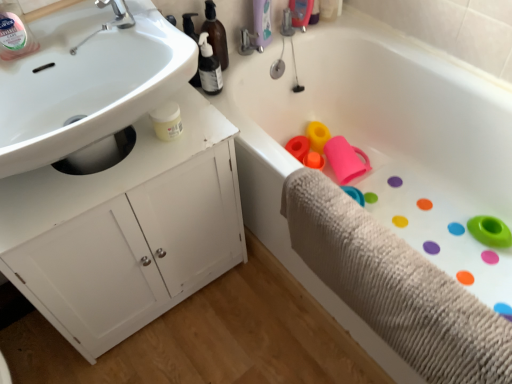
Question: Does clear plastic bottle at upper left have a greater height compared to white matte cabinet at left?

Choices:
 (A) yes
 (B) no

Answer: (B)

Question: From a real-world perspective, is clear plastic bottle at upper left located higher than white matte cabinet at left?

Choices:
 (A) yes
 (B) no

Answer: (A)

Question: Is clear plastic bottle at upper left oriented towards white matte cabinet at left?

Choices:
 (A) yes
 (B) no

Answer: (B)

Question: Is clear plastic bottle at upper left outside of white matte cabinet at left?

Choices:
 (A) yes
 (B) no

Answer: (A)

Question: From the image's perspective, does clear plastic bottle at upper left appear higher than white matte cabinet at left?

Choices:
 (A) no
 (B) yes

Answer: (B)

Question: Is point (23, 23) positioned closer to the camera than point (0, 119)?

Choices:
 (A) closer
 (B) farther

Answer: (B)

Question: Is clear plastic bottle at upper left spatially inside white glossy sink at upper left, or outside of it?

Choices:
 (A) outside
 (B) inside

Answer: (A)

Question: From the image's perspective, is clear plastic bottle at upper left positioned above or below white glossy sink at upper left?

Choices:
 (A) above
 (B) below

Answer: (A)

Question: Is clear plastic bottle at upper left wider or thinner than white glossy sink at upper left?

Choices:
 (A) wide
 (B) thin

Answer: (B)

Question: Which is correct: white glossy sink at upper left is inside beige textured bath towel at lower right, or outside of it?

Choices:
 (A) outside
 (B) inside

Answer: (A)

Question: From the image's perspective, is white glossy sink at upper left positioned above or below beige textured bath towel at lower right?

Choices:
 (A) above
 (B) below

Answer: (A)

Question: Considering the positions of white glossy sink at upper left and beige textured bath towel at lower right in the image, is white glossy sink at upper left taller or shorter than beige textured bath towel at lower right?

Choices:
 (A) tall
 (B) short

Answer: (B)

Question: From a real-world perspective, relative to beige textured bath towel at lower right, is white glossy sink at upper left vertically above or below?

Choices:
 (A) above
 (B) below

Answer: (A)

Question: From the image's perspective, is white glossy sink at upper left positioned above or below silver metallic faucet at upper left?

Choices:
 (A) above
 (B) below

Answer: (B)

Question: Considering the positions of white glossy sink at upper left and silver metallic faucet at upper left in the image, is white glossy sink at upper left wider or thinner than silver metallic faucet at upper left?

Choices:
 (A) wide
 (B) thin

Answer: (A)